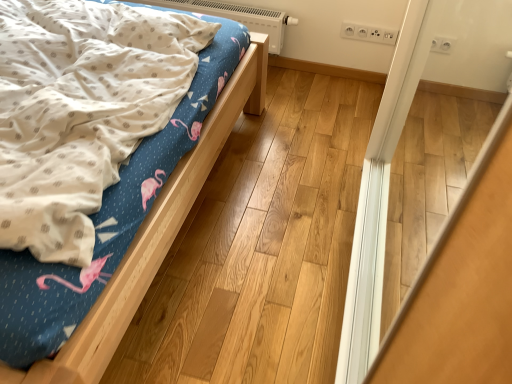
Describe the element at coordinates (154, 217) in the screenshot. I see `matte wood bed at left` at that location.

Find the location of `matte wood bed at left`. matte wood bed at left is located at coordinates (154, 217).

I want to click on white plastic heater at upper center, so click(241, 17).

The image size is (512, 384). What do you see at coordinates (241, 17) in the screenshot?
I see `white plastic heater at upper center` at bounding box center [241, 17].

Locate an element on the screen. This screenshot has width=512, height=384. matte wood bed at left is located at coordinates (154, 217).

Is matte wood bed at left at the left side of white plastic heater at upper center?

Yes, matte wood bed at left is to the left of white plastic heater at upper center.

Who is more distant, matte wood bed at left or white plastic heater at upper center?

Positioned behind is white plastic heater at upper center.

Does point (177, 119) come farther from viewer compared to point (182, 4)?

No, (177, 119) is closer to viewer.

From the image's perspective, is matte wood bed at left under white plastic heater at upper center?

Correct, matte wood bed at left appears lower than white plastic heater at upper center in the image.

From a real-world perspective, between matte wood bed at left and white plastic heater at upper center, who is vertically higher?

matte wood bed at left, from a real-world perspective.

Looking at their sizes, would you say matte wood bed at left is wider or thinner than white plastic heater at upper center?

Clearly, matte wood bed at left has more width compared to white plastic heater at upper center.

Does matte wood bed at left have a greater height compared to white plastic heater at upper center?

Indeed, matte wood bed at left has a greater height compared to white plastic heater at upper center.

Is matte wood bed at left smaller than white plastic heater at upper center?

Incorrect, matte wood bed at left is not smaller in size than white plastic heater at upper center.

Is matte wood bed at left inside or outside of white plastic heater at upper center?

matte wood bed at left is spatially situated outside white plastic heater at upper center.

Consider the image. Is matte wood bed at left directly adjacent to white plastic heater at upper center?

There is a gap between matte wood bed at left and white plastic heater at upper center.

Is matte wood bed at left oriented away from white plastic heater at upper center?

matte wood bed at left is not turned away from white plastic heater at upper center.

You are a GUI agent. You are given a task and a screenshot of the screen. Output one action in this format:
    pyautogui.click(x=<x>, y=<y>)
    Task: Click on the bed on the left of white plastic heater at upper center
    
    Given the screenshot: What is the action you would take?
    coord(154,217)

Is white plastic heater at upper center to the left of matte wood bed at left from the viewer's perspective?

Incorrect, white plastic heater at upper center is not on the left side of matte wood bed at left.

Is white plastic heater at upper center in front of or behind matte wood bed at left in the image?

In the image, white plastic heater at upper center appears behind matte wood bed at left.

Which point is more distant from viewer, (201, 12) or (234, 71)?

The point (201, 12) is behind.

From the image's perspective, does white plastic heater at upper center appear higher than matte wood bed at left?

Indeed, from the image's perspective, white plastic heater at upper center is shown above matte wood bed at left.

From a real-world perspective, relative to matte wood bed at left, is white plastic heater at upper center vertically above or below?

Clearly, from a real-world perspective, white plastic heater at upper center is below matte wood bed at left.

In terms of width, does white plastic heater at upper center look wider or thinner when compared to matte wood bed at left?

Considering their sizes, white plastic heater at upper center looks slimmer than matte wood bed at left.

Considering the sizes of objects white plastic heater at upper center and matte wood bed at left in the image provided, who is shorter, white plastic heater at upper center or matte wood bed at left?

With less height is white plastic heater at upper center.

Considering the relative sizes of white plastic heater at upper center and matte wood bed at left in the image provided, is white plastic heater at upper center smaller than matte wood bed at left?

Indeed, white plastic heater at upper center has a smaller size compared to matte wood bed at left.

Is white plastic heater at upper center spatially inside matte wood bed at left, or outside of it?

white plastic heater at upper center is located beyond the bounds of matte wood bed at left.

Is white plastic heater at upper center not close to matte wood bed at left?

white plastic heater at upper center is near matte wood bed at left, not far away.

In the scene shown: Is matte wood bed at left at the back of white plastic heater at upper center?

No, white plastic heater at upper center is not facing the opposite direction of matte wood bed at left.

The width and height of the screenshot is (512, 384). In order to click on heater that appears on the right of matte wood bed at left in this screenshot , I will do `click(241, 17)`.

Identify the location of bed located above the white plastic heater at upper center (from a real-world perspective). The width and height of the screenshot is (512, 384). (154, 217).

At what (x,y) coordinates should I click in order to perform the action: click on bed lying in front of the white plastic heater at upper center. Please return your answer as a coordinate pair (x, y). This screenshot has width=512, height=384. Looking at the image, I should click on (154, 217).